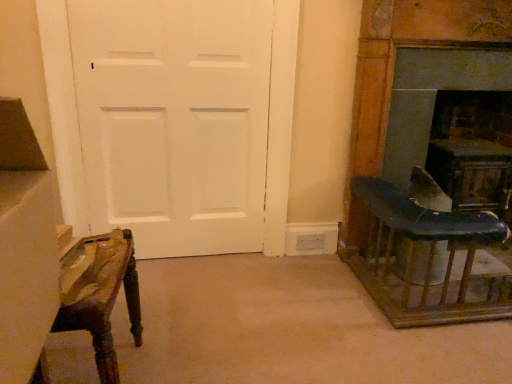
Question: Looking at their shapes, would you say white matte door at left is wider or thinner than wooden chair at right?

Choices:
 (A) wide
 (B) thin

Answer: (B)

Question: Would you say white matte door at left is inside or outside wooden chair at right?

Choices:
 (A) inside
 (B) outside

Answer: (B)

Question: Which object is positioned farthest from the wooden chair at right?

Choices:
 (A) white matte door at left
 (B) blue leather chair at right
 (C) dark gray stone fireplace at right

Answer: (A)

Question: Estimate the real-world distances between objects in this image. Which object is closer to the blue leather chair at right?

Choices:
 (A) dark gray stone fireplace at right
 (B) white matte door at left
 (C) wooden chair at right

Answer: (A)